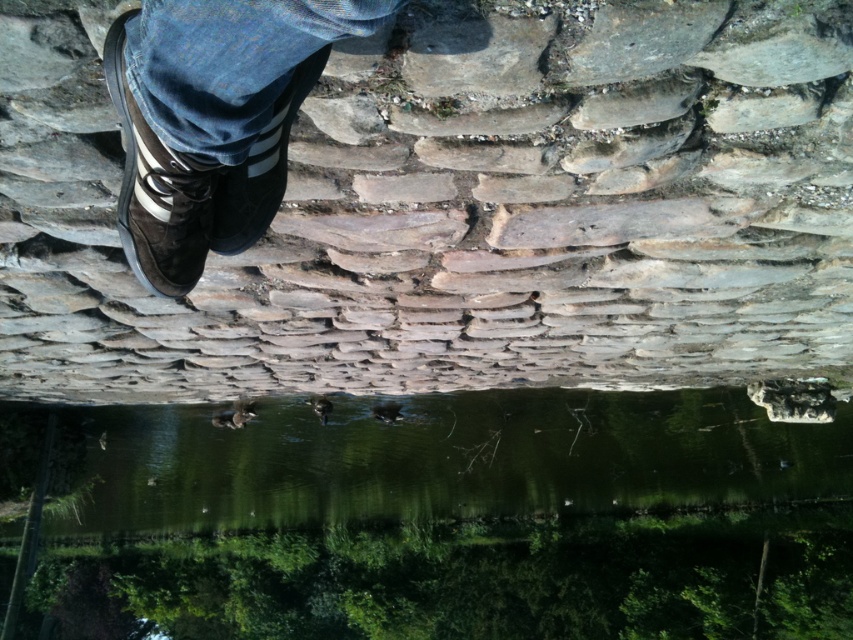
You are standing on the stone wall and looking down at the green reflective water at center and the brown suede shoe at upper left. Which object is closer to your viewpoint?

The green reflective water at center is closer to your viewpoint because the brown suede shoe at upper left is behind it.

You are standing at the bottom of the rotated image, which is actually the sky area. You want to place a small flag on the ground, which is at the top of the image. To ensure the flag is visible from your current position, should you place it closer to the green reflective water at center or the brown suede shoe at upper left?

The green reflective water at center is taller than the brown suede shoe at upper left. Since you want the flag to be visible from your position at the bottom, placing it closer to the taller green reflective water at center would make it more visible as it rises higher in the rotated image.